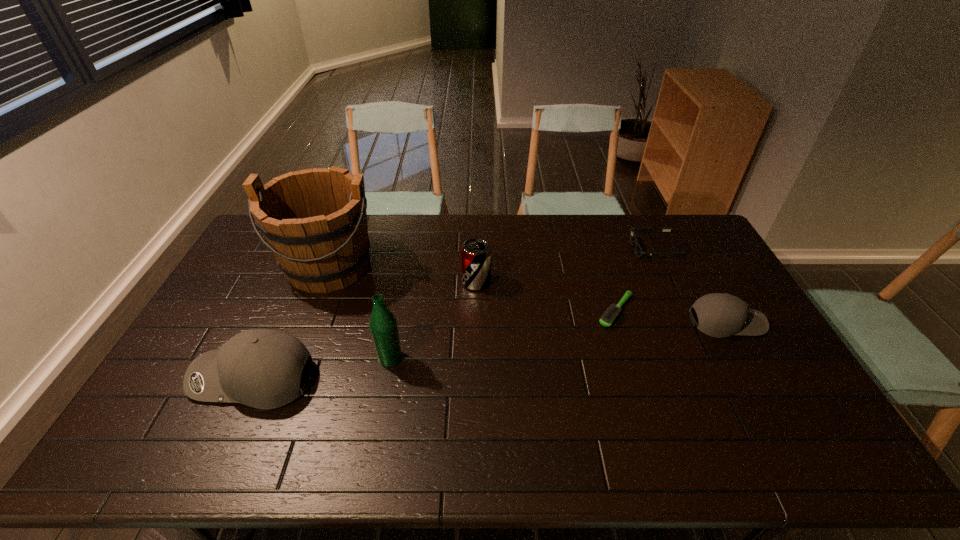
Locate an element on the screen. This screenshot has height=540, width=960. bottle is located at coordinates (383, 326).

The width and height of the screenshot is (960, 540). Identify the location of free region located 0.140m on the temples of the sunglasses. (594, 250).

Where is `blank area located on the temples of the sunglasses`? This screenshot has height=540, width=960. blank area located on the temples of the sunglasses is located at coordinates (553, 250).

I want to click on blank space located on the temples of the sunglasses, so click(x=531, y=250).

Identify the location of vacant space located 0.070m on the side of the wine bucket with the handle for carrying. This screenshot has width=960, height=540. (310, 315).

This screenshot has width=960, height=540. In order to click on free point located on the left of the shortest object in this screenshot , I will do `click(576, 311)`.

Identify the location of free space located 0.220m on the back of the soda can. (477, 234).

This screenshot has width=960, height=540. What are the coordinates of `free spot located on the front of the second tallest object` in the screenshot? It's located at (385, 387).

At what (x,y) coordinates should I click in order to perform the action: click on sunglasses that is at the far edge. Please return your answer as a coordinate pair (x, y). The image size is (960, 540). Looking at the image, I should click on (638, 250).

Locate an element on the screen. The width and height of the screenshot is (960, 540). wine bucket positioned at the far edge is located at coordinates (314, 221).